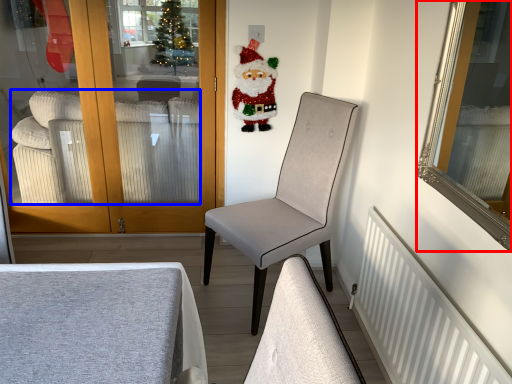
Question: Which object is further to the camera taking this photo, mirror (highlighted by a red box) or studio couch (highlighted by a blue box)?

Choices:
 (A) mirror
 (B) studio couch

Answer: (B)